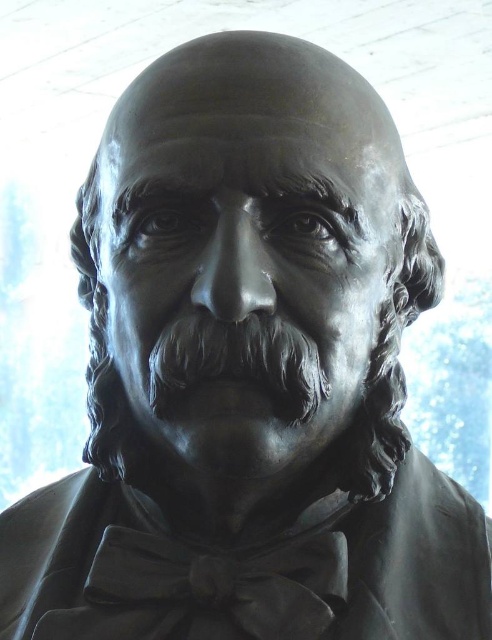
Is black satin bow tie at center above black matte beard at center?

Incorrect, black satin bow tie at center is not positioned above black matte beard at center.

Can you confirm if black satin bow tie at center is wider than black matte beard at center?

Indeed, black satin bow tie at center has a greater width compared to black matte beard at center.

Which is in front, point (273, 552) or point (214, 326)?

Point (214, 326) is more forward.

Locate an element on the screen. This screenshot has width=492, height=640. black satin bow tie at center is located at coordinates (215, 588).